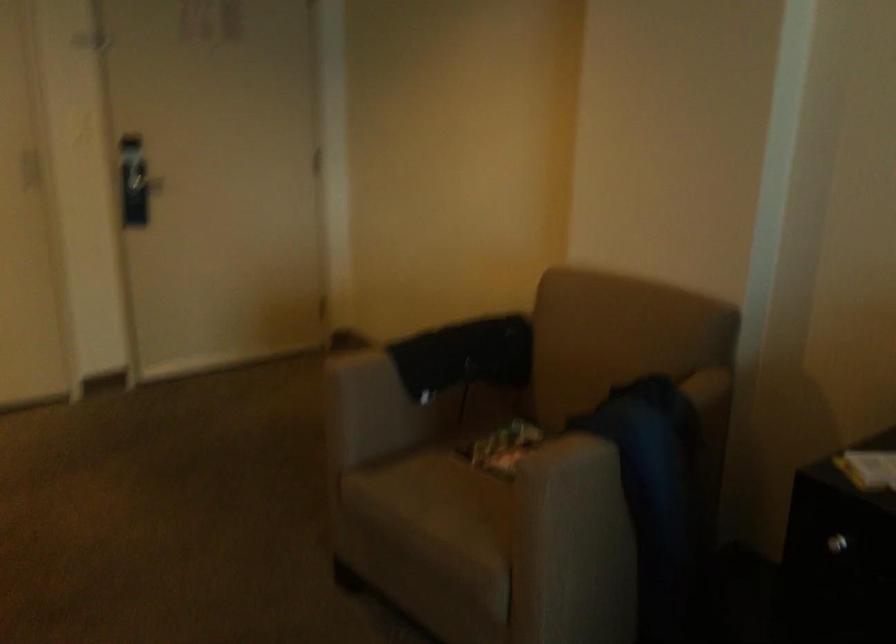
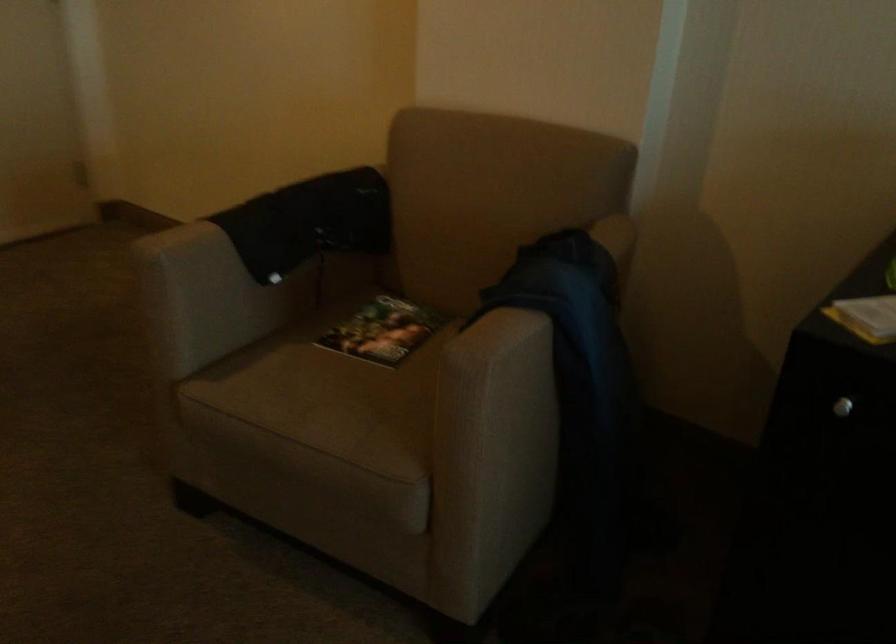
Locate, in the second image, the point that corresponds to (x=449, y=504) in the first image.

(330, 404)